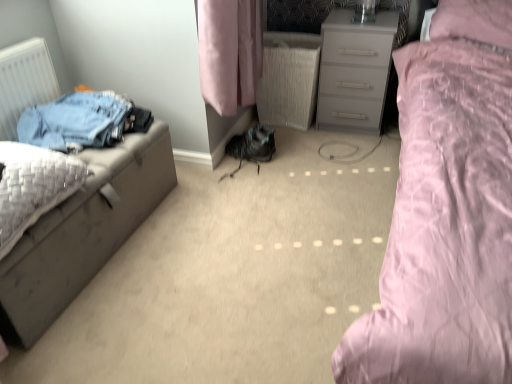
At what (x,y) coordinates should I click in order to perform the action: click on pink satin bed at right. Please return your answer as a coordinate pair (x, y). The image size is (512, 384). Looking at the image, I should click on (447, 212).

What is the approximate width of matte gray nightstand at left?

It is 58.81 centimeters.

At what (x,y) coordinates should I click in order to perform the action: click on white matte radiator at left. Please return your answer as a coordinate pair (x, y). The width and height of the screenshot is (512, 384). Looking at the image, I should click on (24, 82).

Where is `matte gray chest of drawers at center`? This screenshot has height=384, width=512. matte gray chest of drawers at center is located at coordinates (354, 71).

Measure the distance between matte gray chest of drawers at center and camera.

matte gray chest of drawers at center and camera are 7.19 feet apart.

You are a GUI agent. You are given a task and a screenshot of the screen. Output one action in this format:
    pyautogui.click(x=<x>, y=<y>)
    Task: Click on the pink satin bed at right
    The width and height of the screenshot is (512, 384).
    Given the screenshot: What is the action you would take?
    pyautogui.click(x=447, y=212)

Is pink satin bed at right next to matte gray chest of drawers at center?

No.

From the image's perspective, is pink satin bed at right located above or below matte gray chest of drawers at center?

pink satin bed at right is situated lower than matte gray chest of drawers at center in the image.

From a real-world perspective, which is physically above, pink satin bed at right or matte gray chest of drawers at center?

pink satin bed at right.

Is pink satin bed at right beside white matte radiator at left?

pink satin bed at right is not next to white matte radiator at left, and they're not touching.

From the picture: Does pink satin bed at right lie behind white matte radiator at left?

No, pink satin bed at right is in front of white matte radiator at left.

Measure the distance from pink satin bed at right to white matte radiator at left.

pink satin bed at right and white matte radiator at left are 1.62 meters apart from each other.

Could white matte radiator at left be considered to be inside pink satin bed at right?

No, white matte radiator at left is located outside of pink satin bed at right.

From the picture: Considering their positions, is matte gray nightstand at left located in front of or behind white matte radiator at left?

matte gray nightstand at left is in front of white matte radiator at left.

Between matte gray nightstand at left and white matte radiator at left, which one appears on the right side from the viewer's perspective?

Answer: Positioned to the right is matte gray nightstand at left.

Locate an element on the screen. radiator behind the matte gray nightstand at left is located at coordinates pyautogui.click(x=24, y=82).

Is matte gray chest of drawers at center at the back of white matte radiator at left?

white matte radiator at left is not turned away from matte gray chest of drawers at center.

This screenshot has height=384, width=512. In the image, there is a white matte radiator at left. What are the coordinates of `the chest of drawers below it (from a real-world perspective)` in the screenshot? It's located at (354, 71).

From a real-world perspective, which is physically below, white matte radiator at left or matte gray chest of drawers at center?

matte gray chest of drawers at center is physically lower.

Does white matte radiator at left have a lesser height compared to matte gray chest of drawers at center?

Yes.

From the image's perspective, which one is positioned higher, pink satin bed at right or matte gray nightstand at left?

pink satin bed at right, from the image's perspective.

Is pink satin bed at right inside or outside of matte gray nightstand at left?

pink satin bed at right is located beyond the bounds of matte gray nightstand at left.

Is pink satin bed at right to the right of matte gray nightstand at left from the viewer's perspective?

Yes, pink satin bed at right is to the right of matte gray nightstand at left.

Could you tell me if pink satin bed at right is turned towards matte gray nightstand at left?

No.

Consider the image. Is matte gray chest of drawers at center to the left of matte gray nightstand at left from the viewer's perspective?

No, matte gray chest of drawers at center is not to the left of matte gray nightstand at left.

Is matte gray chest of drawers at center in contact with matte gray nightstand at left?

No, matte gray chest of drawers at center is not making contact with matte gray nightstand at left.

Does matte gray chest of drawers at center have a smaller size compared to matte gray nightstand at left?

Indeed, matte gray chest of drawers at center has a smaller size compared to matte gray nightstand at left.

Looking at this image, from the image's perspective, between matte gray chest of drawers at center and matte gray nightstand at left, who is located below?

From the image's view, matte gray nightstand at left is below.

Which point is more distant from viewer, (341, 107) or (5, 77)?

The point (341, 107) is farther.

Is matte gray chest of drawers at center placed right next to white matte radiator at left?

There is a gap between matte gray chest of drawers at center and white matte radiator at left.

Is matte gray chest of drawers at center positioned beyond the bounds of white matte radiator at left?

Yes, matte gray chest of drawers at center is not within white matte radiator at left.

Is matte gray chest of drawers at center oriented towards white matte radiator at left?

No, matte gray chest of drawers at center does not turn towards white matte radiator at left.

Where is `bed above the matte gray chest of drawers at center (from a real-world perspective)`? bed above the matte gray chest of drawers at center (from a real-world perspective) is located at coordinates (447, 212).

Identify the location of bed in front of the white matte radiator at left. (447, 212).

Estimate the real-world distances between objects in this image. Which object is further from pink satin bed at right, matte gray nightstand at left or white matte radiator at left?

Based on the image, white matte radiator at left appears to be further to pink satin bed at right.

Based on their spatial positions, is pink satin bed at right or matte gray nightstand at left closer to white matte radiator at left?

matte gray nightstand at left lies closer to white matte radiator at left than the other object.

From the image, which object appears to be farther from white matte radiator at left, matte gray nightstand at left or pink satin bed at right?

The object further to white matte radiator at left is pink satin bed at right.

Which object lies nearer to the anchor point pink satin bed at right, matte gray chest of drawers at center or white matte radiator at left?

matte gray chest of drawers at center is positioned closer to the anchor pink satin bed at right.

From the image, which object appears to be farther from pink satin bed at right, matte gray chest of drawers at center or matte gray nightstand at left?

Among the two, matte gray nightstand at left is located further to pink satin bed at right.

Estimate the real-world distances between objects in this image. Which object is closer to pink satin bed at right, white matte radiator at left or matte gray chest of drawers at center?

matte gray chest of drawers at center is positioned closer to the anchor pink satin bed at right.

Estimate the real-world distances between objects in this image. Which object is closer to matte gray chest of drawers at center, matte gray nightstand at left or white matte radiator at left?

matte gray nightstand at left lies closer to matte gray chest of drawers at center than the other object.

Which object lies nearer to the anchor point matte gray chest of drawers at center, matte gray nightstand at left or pink satin bed at right?

The object closer to matte gray chest of drawers at center is pink satin bed at right.

This screenshot has width=512, height=384. I want to click on nightstand located between white matte radiator at left and pink satin bed at right in the left-right direction, so click(82, 233).

Find the location of a particular element. nightstand positioned between pink satin bed at right and matte gray chest of drawers at center from near to far is located at coordinates (82, 233).

I want to click on chest of drawers between white matte radiator at left and pink satin bed at right, so click(x=354, y=71).

Find the location of a particular element. This screenshot has width=512, height=384. nightstand located between white matte radiator at left and matte gray chest of drawers at center in the left-right direction is located at coordinates (82, 233).